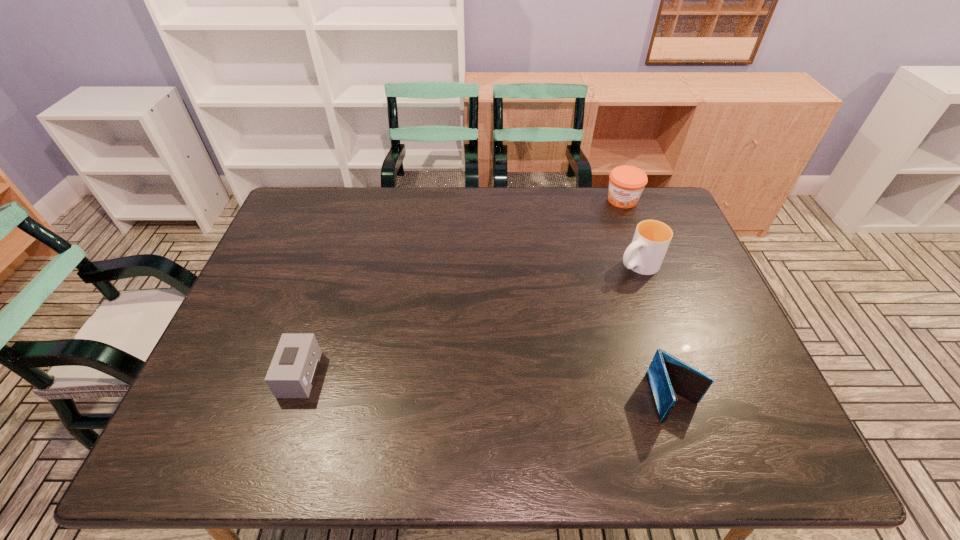
You are a GUI agent. You are given a task and a screenshot of the screen. Output one action in this format:
    pyautogui.click(x=<x>, y=<y>)
    Task: Click on the shortest object
    Image resolution: width=960 pixels, height=540 pixels.
    Given the screenshot: What is the action you would take?
    pyautogui.click(x=292, y=372)

The width and height of the screenshot is (960, 540). Find the location of `the leftmost object`. the leftmost object is located at coordinates (292, 372).

The width and height of the screenshot is (960, 540). Find the location of `wallet`. wallet is located at coordinates (667, 375).

The width and height of the screenshot is (960, 540). I want to click on the third nearest object, so click(645, 254).

You are a GUI agent. You are given a task and a screenshot of the screen. Output one action in this format:
    pyautogui.click(x=<x>, y=<y>)
    Task: Click on the farthest object
    The height and width of the screenshot is (540, 960).
    Given the screenshot: What is the action you would take?
    pyautogui.click(x=626, y=183)

Identify the location of vacant space located on the front-facing side of the shortest object. Image resolution: width=960 pixels, height=540 pixels. pyautogui.click(x=247, y=375).

In order to click on vacant space located on the front-facing side of the shortest object in this screenshot , I will do `click(238, 375)`.

This screenshot has width=960, height=540. What are the coordinates of `blank space located on the front-facing side of the shortest object` in the screenshot? It's located at (251, 375).

Locate an element on the screen. The width and height of the screenshot is (960, 540). free point located 0.110m with the handle on the side of the cup is located at coordinates [x=593, y=288].

The image size is (960, 540). In order to click on free space located with the handle on the side of the cup in this screenshot , I will do `click(557, 309)`.